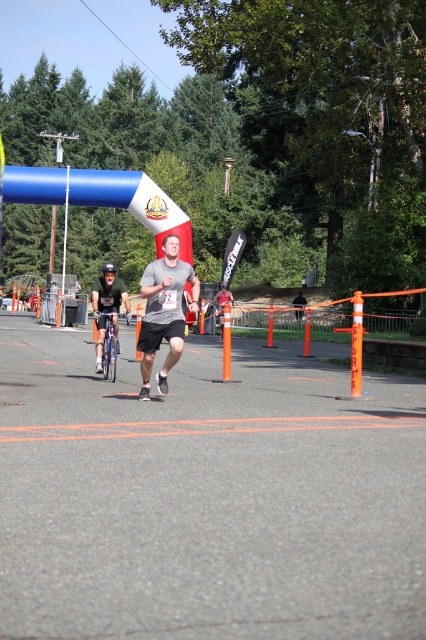
Question: Which of the following is the farthest from the observer?

Choices:
 (A) gray matte shirt at center
 (B) green matte shirt at center

Answer: (B)

Question: Which point appears farthest from the camera in this image?

Choices:
 (A) (161, 275)
 (B) (109, 310)

Answer: (B)

Question: Is gray matte shirt at center behind green matte shirt at center?

Choices:
 (A) yes
 (B) no

Answer: (B)

Question: Among these objects, which one is nearest to the camera?

Choices:
 (A) gray matte shirt at center
 (B) green matte shirt at center

Answer: (A)

Question: Does gray matte shirt at center have a lesser width compared to green matte shirt at center?

Choices:
 (A) yes
 (B) no

Answer: (A)

Question: Is gray matte shirt at center closer to camera compared to green matte shirt at center?

Choices:
 (A) yes
 (B) no

Answer: (A)